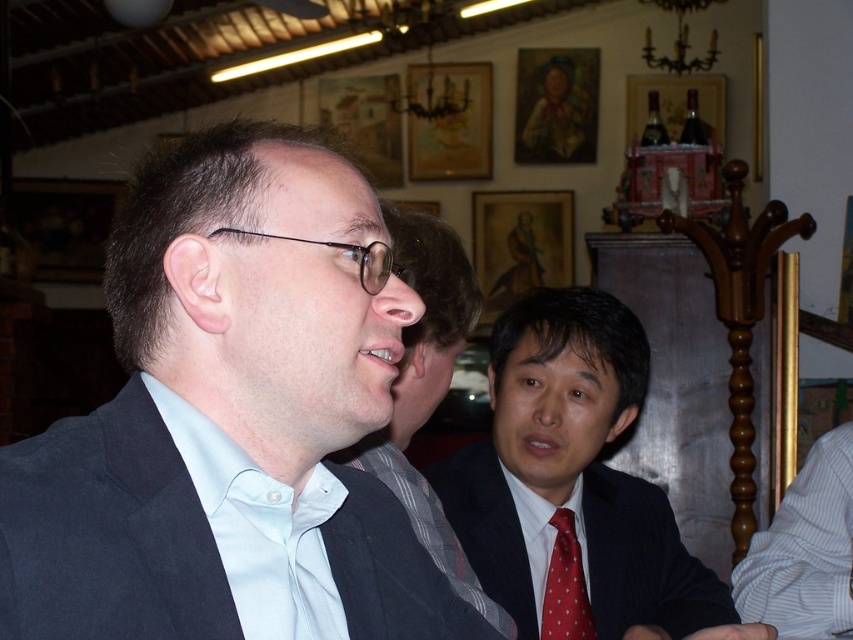
You are a fashion designer observing the matte gray vest at center and the red dotted fabric tie at center. Which one do you think would be more suitable for a formal event, considering their sizes?

The matte gray vest at center has a larger size compared to the red dotted fabric tie at center, so it would be more suitable for a formal event as larger garments often make a bolder statement in formal settings.

You are a photographer setting up for a group photo. You notice the matte gray vest at center and the white striped shirt at lower right in your frame. Which clothing item should you adjust to ensure both are fully visible in the photo?

The matte gray vest at center is much taller than the white striped shirt at lower right, so you should adjust the matte gray vest at center to ensure it doesn not block the view of the white striped shirt at lower right.